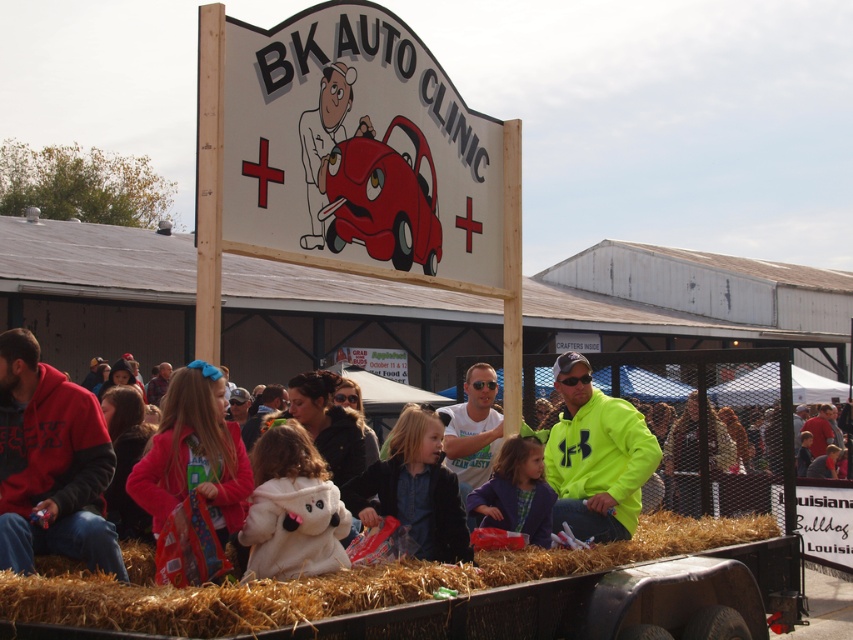
You are a photographer at the fair and want to take a photo of both the neon green jacket at center and the red fleece jacket at center in the same frame. Your camera has a maximum focus range of 5 meters. Can you capture both jackets in one shot without moving the camera?

The distance between the neon green jacket at center and the red fleece jacket at center is 5.01 meters, which exceeds the camera maximum focus range of 5 meters. Therefore, you cannot capture both jackets in one shot without moving the camera.

You are at the fair and want to take a photo of both the neon yellow jacket at center and the matte blue jacket at center. Which jacket should you focus on first to ensure both are in the frame?

You should focus on the neon yellow jacket at center first since it is closer to you than the matte blue jacket at center, ensuring both are in the frame by adjusting the camera angle accordingly.

You are a photographer standing at the edge of the fairground, and you want to take a photo of both the neon yellow jacket at center and the matte blue jacket at center in the same frame. Given that your camera has a maximum focus range of 24 inches, will you be able to capture both jackets clearly in one shot?

The distance between the neon yellow jacket at center and the matte blue jacket at center is 24.34 inches. Since the camera can only focus within 24 inches, the jackets are slightly beyond the focus range, so they might not both be in clear focus in a single shot.